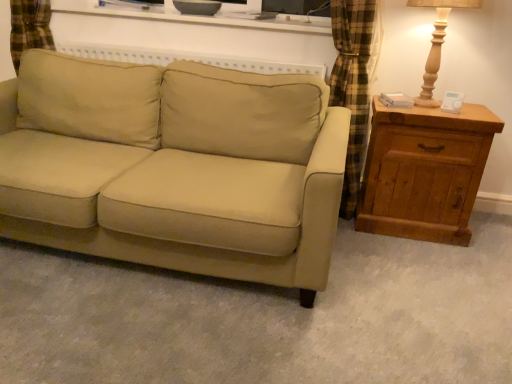
The image size is (512, 384). What do you see at coordinates (424, 171) in the screenshot?
I see `wooden chest of drawers at right` at bounding box center [424, 171].

Find the location of a particular element. This screenshot has height=384, width=512. wooden chest of drawers at right is located at coordinates (424, 171).

What do you see at coordinates (175, 167) in the screenshot? The image size is (512, 384). I see `beige fabric couch at center` at bounding box center [175, 167].

This screenshot has width=512, height=384. Identify the location of wooden table lamp at right. (437, 44).

In order to click on wooden chest of drawers at right in this screenshot , I will do `click(424, 171)`.

In order to click on table lamp on the right of matte white shelf at upper center in this screenshot , I will do `click(437, 44)`.

Between wooden table lamp at right and matte white shelf at upper center, which one is positioned in front?

wooden table lamp at right is in front.

Is wooden table lamp at right oriented towards matte white shelf at upper center?

No, wooden table lamp at right is not aimed at matte white shelf at upper center.

How far apart are wooden table lamp at right and matte white shelf at upper center?

wooden table lamp at right and matte white shelf at upper center are 32.33 inches apart from each other.

From a real-world perspective, is wooden chest of drawers at right above or below beige fabric couch at center?

wooden chest of drawers at right is below beige fabric couch at center.

Find the location of a particular element. Image resolution: width=512 pixels, height=384 pixels. studio couch to the left of wooden chest of drawers at right is located at coordinates 175,167.

Is wooden chest of drawers at right taller than beige fabric couch at center?

In fact, wooden chest of drawers at right may be shorter than beige fabric couch at center.

Would you consider wooden chest of drawers at right to be distant from beige fabric couch at center?

That's not correct — wooden chest of drawers at right is a little close to beige fabric couch at center.

Between point (443, 229) and point (426, 80), which one is positioned in front?

The point (426, 80) is closer to the camera.

Is wooden chest of drawers at right taller than wooden table lamp at right?

Yes.

From a real-world perspective, does wooden chest of drawers at right stand above wooden table lamp at right?

No, from a real-world perspective, wooden chest of drawers at right is not above wooden table lamp at right.

From a real-world perspective, is beige fabric couch at center positioned over wooden chest of drawers at right based on gravity?

Yes, from a real-world perspective, beige fabric couch at center is above wooden chest of drawers at right.

Consider the image. From their relative heights in the image, would you say beige fabric couch at center is taller or shorter than wooden chest of drawers at right?

beige fabric couch at center is taller than wooden chest of drawers at right.

Considering the sizes of objects beige fabric couch at center and wooden chest of drawers at right in the image provided, who is wider, beige fabric couch at center or wooden chest of drawers at right?

Wider between the two is beige fabric couch at center.

From a real-world perspective, is matte white shelf at upper center physically located above or below wooden table lamp at right?

Clearly, from a real-world perspective, matte white shelf at upper center is above wooden table lamp at right.

Is matte white shelf at upper center not near wooden table lamp at right?

Actually, matte white shelf at upper center and wooden table lamp at right are a little close together.

Is point (68, 11) farther from camera compared to point (432, 99)?

Yes, it is.

Which object is positioned more to the left, matte white shelf at upper center or wooden table lamp at right?

matte white shelf at upper center is more to the left.

Considering the relative sizes of beige fabric couch at center and matte white shelf at upper center in the image provided, is beige fabric couch at center taller than matte white shelf at upper center?

Indeed, beige fabric couch at center has a greater height compared to matte white shelf at upper center.

Is beige fabric couch at center situated inside matte white shelf at upper center or outside?

beige fabric couch at center is located beyond the bounds of matte white shelf at upper center.

Considering the sizes of beige fabric couch at center and matte white shelf at upper center in the image, is beige fabric couch at center wider or thinner than matte white shelf at upper center?

Considering their sizes, beige fabric couch at center looks broader than matte white shelf at upper center.

Considering the sizes of objects beige fabric couch at center and matte white shelf at upper center in the image provided, who is bigger, beige fabric couch at center or matte white shelf at upper center?

With larger size is beige fabric couch at center.

Considering the relative sizes of matte white shelf at upper center and wooden chest of drawers at right in the image provided, is matte white shelf at upper center bigger than wooden chest of drawers at right?

No.

From the image's perspective, is matte white shelf at upper center located above or below wooden chest of drawers at right?

Based on their image positions, matte white shelf at upper center is located above wooden chest of drawers at right.

From a real-world perspective, which is physically above, matte white shelf at upper center or wooden chest of drawers at right?

matte white shelf at upper center is physically above.

Does point (122, 11) lie behind point (387, 120)?

Yes.

Locate an element on the screen. This screenshot has width=512, height=384. table lamp beneath the matte white shelf at upper center (from a real-world perspective) is located at coordinates (437, 44).

Find the location of a particular element. Image resolution: width=512 pixels, height=384 pixels. chest of drawers below the beige fabric couch at center (from the image's perspective) is located at coordinates (424, 171).

Looking at the image, which one is located further to matte white shelf at upper center, wooden table lamp at right or beige fabric couch at center?

beige fabric couch at center is further to matte white shelf at upper center.

From the image, which object appears to be farther from wooden chest of drawers at right, beige fabric couch at center or wooden table lamp at right?

beige fabric couch at center is further to wooden chest of drawers at right.

Looking at this image, which object lies nearer to the anchor point wooden chest of drawers at right, wooden table lamp at right or matte white shelf at upper center?

wooden table lamp at right is positioned closer to the anchor wooden chest of drawers at right.

Based on the photo, when comparing their distances from beige fabric couch at center, does wooden table lamp at right or wooden chest of drawers at right seem further?

wooden table lamp at right is further to beige fabric couch at center.

Looking at the image, which one is located further to beige fabric couch at center, wooden chest of drawers at right or matte white shelf at upper center?

matte white shelf at upper center lies further to beige fabric couch at center than the other object.

In the scene shown: When comparing their distances from wooden chest of drawers at right, does beige fabric couch at center or matte white shelf at upper center seem further?

matte white shelf at upper center lies further to wooden chest of drawers at right than the other object.

Looking at the image, which one is located closer to wooden table lamp at right, beige fabric couch at center or wooden chest of drawers at right?

wooden chest of drawers at right is positioned closer to the anchor wooden table lamp at right.

Based on their spatial positions, is wooden table lamp at right or wooden chest of drawers at right further from matte white shelf at upper center?

wooden chest of drawers at right.

Where is `entertainment center between beige fabric couch at center and wooden table lamp at right in the horizontal direction`? This screenshot has height=384, width=512. entertainment center between beige fabric couch at center and wooden table lamp at right in the horizontal direction is located at coordinates (197, 16).

This screenshot has height=384, width=512. I want to click on table lamp between beige fabric couch at center and wooden chest of drawers at right in the horizontal direction, so click(x=437, y=44).

Find the location of a particular element. The image size is (512, 384). table lamp situated between matte white shelf at upper center and wooden chest of drawers at right from left to right is located at coordinates (437, 44).

The width and height of the screenshot is (512, 384). Identify the location of entertainment center situated between beige fabric couch at center and wooden chest of drawers at right from left to right. (197, 16).